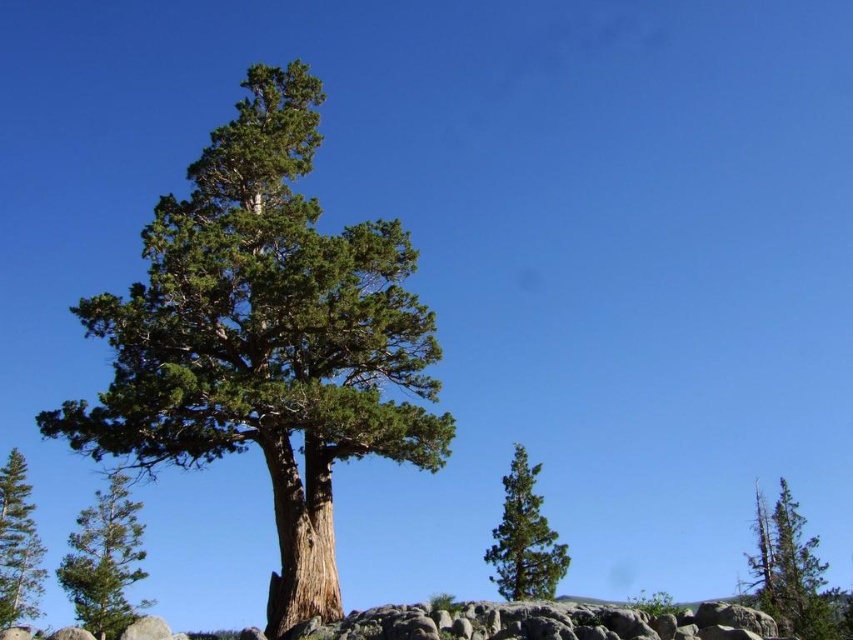
Question: Does green rough bark tree at center appear under green rough bark tree at left?

Choices:
 (A) no
 (B) yes

Answer: (A)

Question: Which of the following is the farthest from the observer?

Choices:
 (A) green rough bark tree at lower left
 (B) green rough bark tree at center
 (C) green rough bark tree at left
 (D) green rough bark tree at lower right

Answer: (C)

Question: Based on their relative distances, which object is farther from the green rough bark tree at center?

Choices:
 (A) green rough bark tree at lower right
 (B) green rough bark tree at left

Answer: (B)

Question: Among these points, which one is nearest to the camera?

Choices:
 (A) (764, 592)
 (B) (383, 268)

Answer: (B)

Question: Is green rough bark tree at center further to camera compared to green rough bark tree at lower left?

Choices:
 (A) yes
 (B) no

Answer: (B)

Question: Does green rough bark tree at center appear over green rough bark tree at left?

Choices:
 (A) no
 (B) yes

Answer: (B)